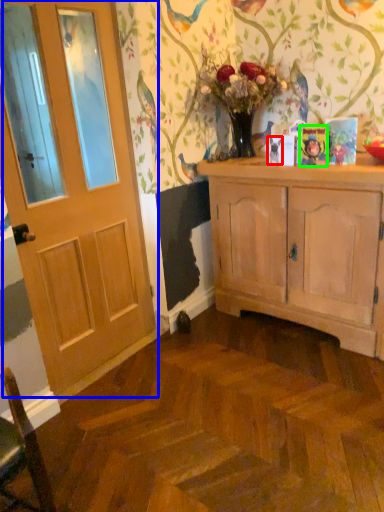
Question: Which object is the closest to the bird (highlighted by a red box)? Choose among these: door (highlighted by a blue box) or picture frame (highlighted by a green box).

Choices:
 (A) door
 (B) picture frame

Answer: (B)